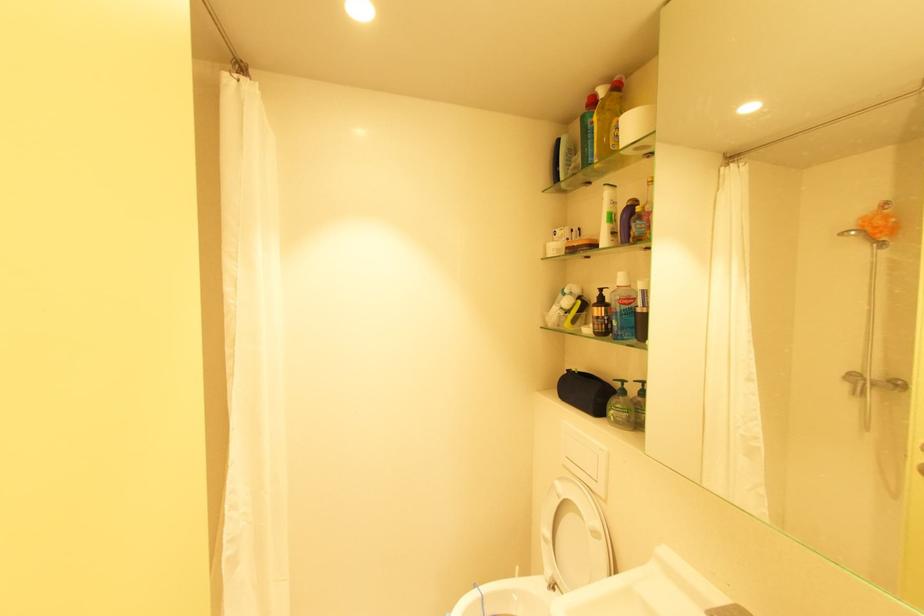
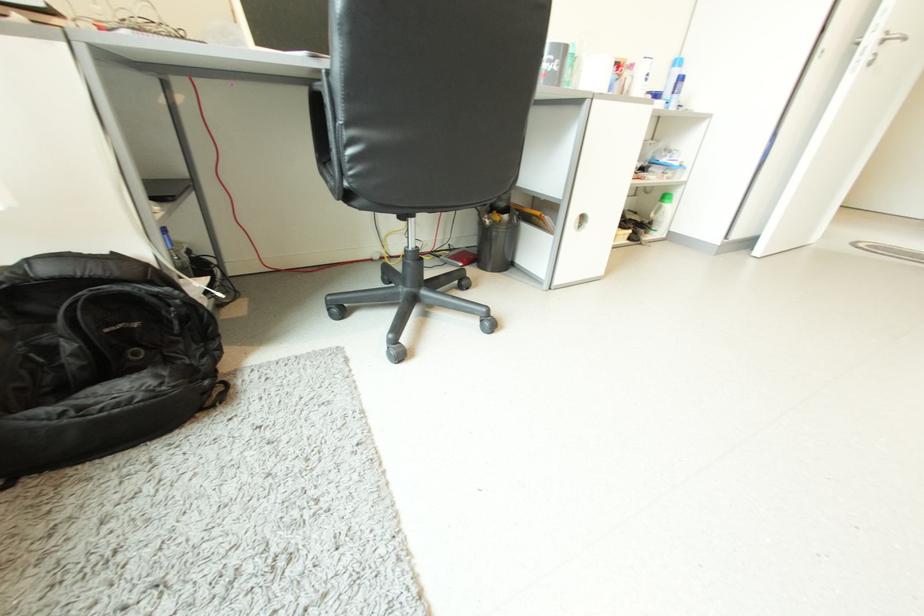
Question: I am providing you with two images of the same scene from different viewpoints. Which of the following objects are not visible in image2?

Choices:
 (A) green pump dispenser head
 (B) blue aerosol can
 (C) bottle with green cap
 (D) red blocky toy

Answer: (A)